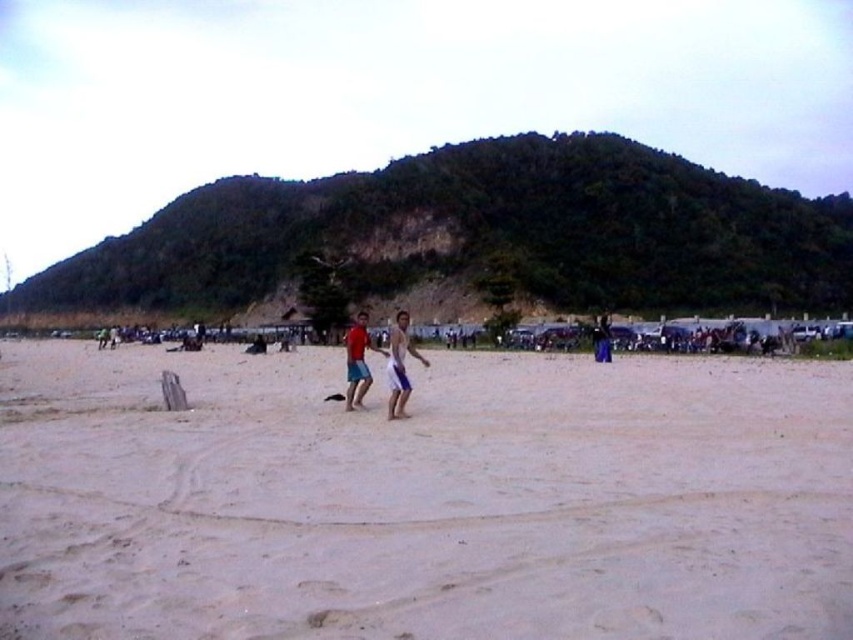
Who is higher up, light beige sand at center or light blue shorts at center?

light blue shorts at center is higher up.

Which is more to the left, light beige sand at center or light blue shorts at center?

light blue shorts at center

Who is more forward, (x=57, y=468) or (x=404, y=346)?

Point (x=57, y=468)

The height and width of the screenshot is (640, 853). I want to click on light beige sand at center, so click(422, 499).

Which is more to the right, light beige sand at center or matte red shorts at center?

light beige sand at center

The width and height of the screenshot is (853, 640). Describe the element at coordinates (422, 499) in the screenshot. I see `light beige sand at center` at that location.

Image resolution: width=853 pixels, height=640 pixels. I want to click on light beige sand at center, so click(x=422, y=499).

At what (x,y) coordinates should I click in order to perform the action: click on light blue shorts at center. Please return your answer as a coordinate pair (x, y). Looking at the image, I should click on (399, 364).

Does light blue shorts at center have a larger size compared to matte red shorts at center?

No.

The image size is (853, 640). What do you see at coordinates (399, 364) in the screenshot?
I see `light blue shorts at center` at bounding box center [399, 364].

Identify the location of light blue shorts at center. The height and width of the screenshot is (640, 853). click(399, 364).